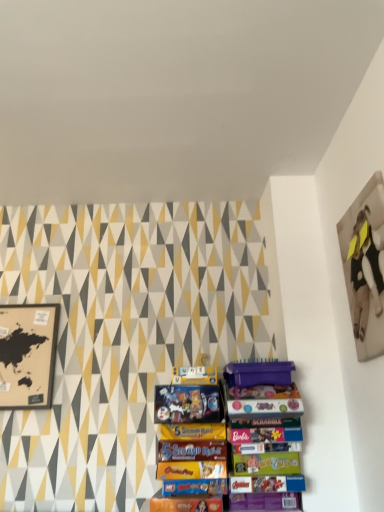
Question: From the image's perspective, is matte black map at left, the 2th picture frame in the front-to-back sequence, located above or below matte black picture frame at upper right, the 1th picture frame from the right?

Choices:
 (A) below
 (B) above

Answer: (A)

Question: From a real-world perspective, is matte black map at left, positioned as the first picture frame in back-to-front order, above or below matte black picture frame at upper right, placed as the second picture frame when sorted from left to right?

Choices:
 (A) above
 (B) below

Answer: (B)

Question: Based on their sizes in the image, would you say matte black map at left, positioned as the second picture frame in right-to-left order, is bigger or smaller than matte black picture frame at upper right, marked as the 2th picture frame in a back-to-front arrangement?

Choices:
 (A) small
 (B) big

Answer: (A)

Question: In terms of size, does matte black picture frame at upper right, placed as the second picture frame when sorted from left to right, appear bigger or smaller than matte black map at left, which is the 1th picture frame in left-to-right order?

Choices:
 (A) big
 (B) small

Answer: (A)

Question: From the image's perspective, is matte black picture frame at upper right, acting as the 1th picture frame starting from the top, above or below matte black map at left, which is the 1th picture frame in left-to-right order?

Choices:
 (A) below
 (B) above

Answer: (B)

Question: Is point (364, 260) positioned closer to the camera than point (34, 324)?

Choices:
 (A) closer
 (B) farther

Answer: (A)

Question: Considering their positions, is matte black picture frame at upper right, acting as the 1th picture frame starting from the top, located in front of or behind matte black map at left, the 2th picture frame in the front-to-back sequence?

Choices:
 (A) behind
 (B) front

Answer: (B)